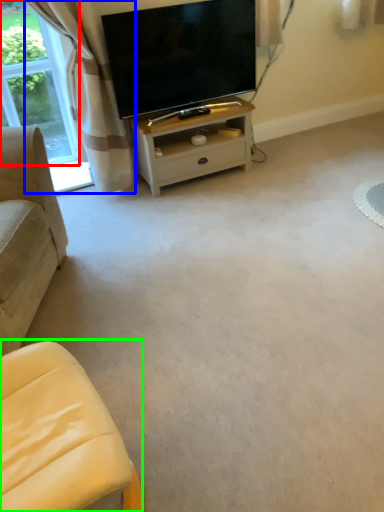
Question: Considering the real-world distances, which object is farthest from bay window (highlighted by a red box)? curtain (highlighted by a blue box) or studio couch (highlighted by a green box)?

Choices:
 (A) curtain
 (B) studio couch

Answer: (B)